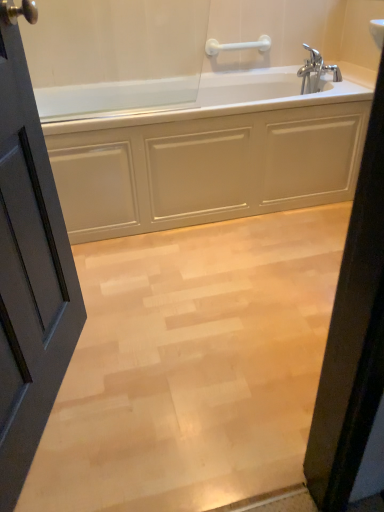
Locate an element on the screen. The height and width of the screenshot is (512, 384). vacant area that is situated to the right of matte gray door at left is located at coordinates (173, 394).